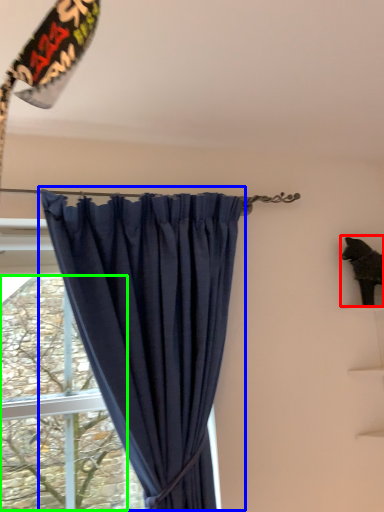
Question: Which is farther away from animal (highlighted by a red box)? curtain (highlighted by a blue box) or tree (highlighted by a green box)?

Choices:
 (A) curtain
 (B) tree

Answer: (B)